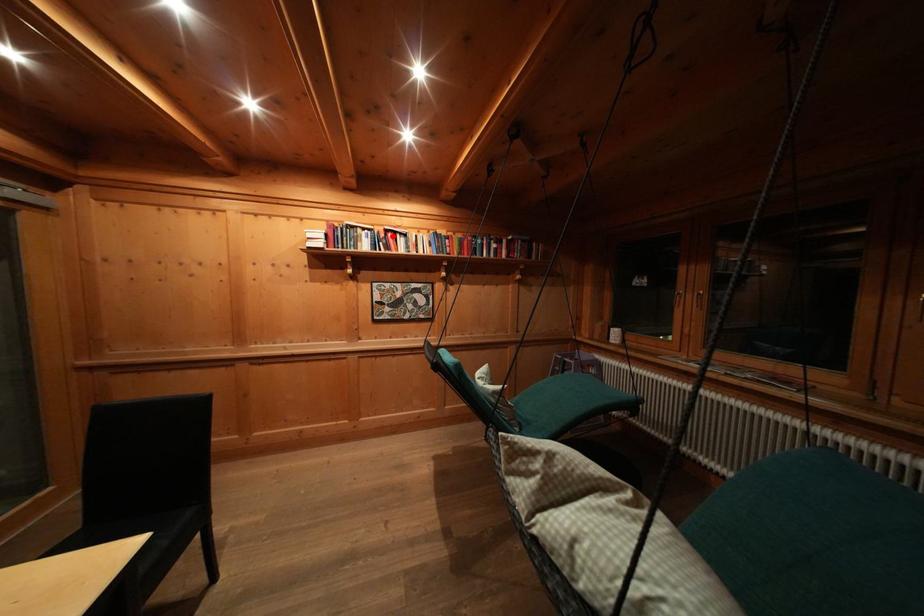
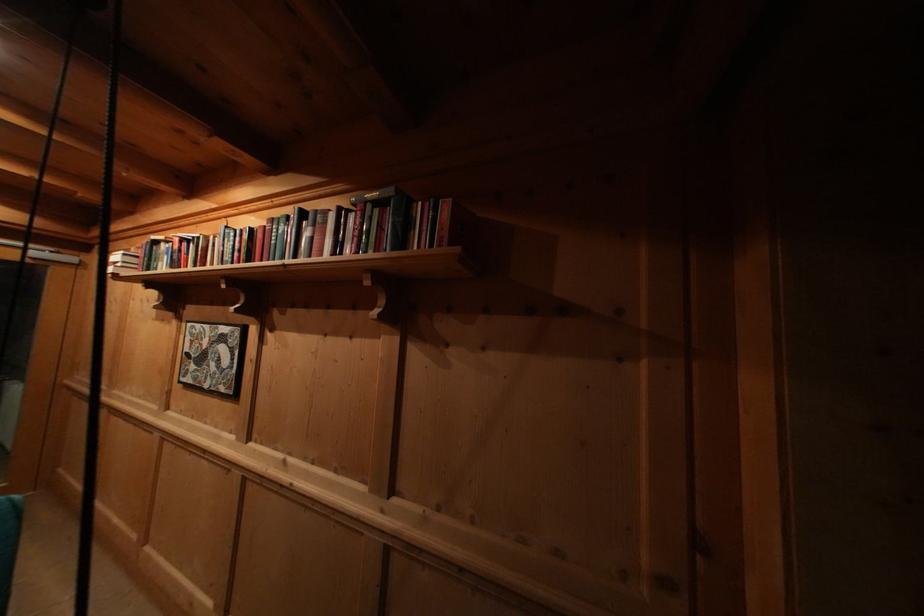
Locate, in the second image, the point that corresponds to the highlighted location in the first image.

(188, 246)